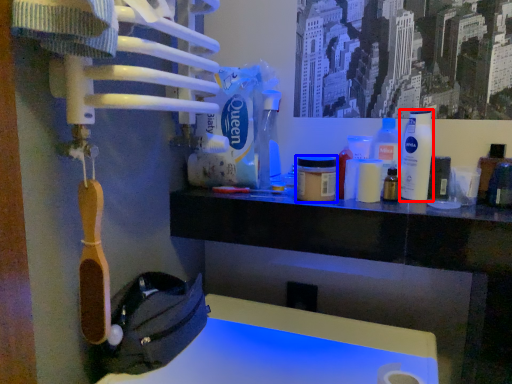
Question: Which point is further to the camera, bottle (highlighted by a red box) or mouthwash (highlighted by a blue box)?

Choices:
 (A) bottle
 (B) mouthwash

Answer: (A)